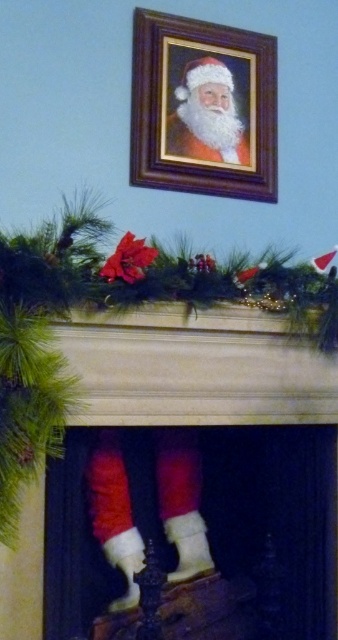
Who is lower down, gold/wooden picture frame at upper center or white fluffy santa at upper center?

white fluffy santa at upper center is lower down.

Does gold/wooden picture frame at upper center appear over white fluffy santa at upper center?

Indeed, gold/wooden picture frame at upper center is positioned over white fluffy santa at upper center.

The height and width of the screenshot is (640, 338). I want to click on gold/wooden picture frame at upper center, so click(x=203, y=108).

Find the location of `gold/wooden picture frame at upper center`. gold/wooden picture frame at upper center is located at coordinates (203, 108).

Describe the element at coordinates (196, 369) in the screenshot. I see `velvet red stocking at lower center` at that location.

Does point (196, 321) come closer to viewer compared to point (198, 150)?

Yes, point (196, 321) is in front of point (198, 150).

Where is `velvet red stocking at lower center`? The width and height of the screenshot is (338, 640). velvet red stocking at lower center is located at coordinates (196, 369).

Which is in front, point (117, 419) or point (277, 192)?

Point (117, 419) is more forward.

Is velvet red stocking at lower center to the left of gold/wooden picture frame at upper center from the viewer's perspective?

Correct, you'll find velvet red stocking at lower center to the left of gold/wooden picture frame at upper center.

Which is in front, point (298, 380) or point (242, 131)?

Positioned in front is point (298, 380).

At what (x,y) coordinates should I click in order to perform the action: click on velvet red stocking at lower center. Please return your answer as a coordinate pair (x, y). The height and width of the screenshot is (640, 338). Looking at the image, I should click on (196, 369).